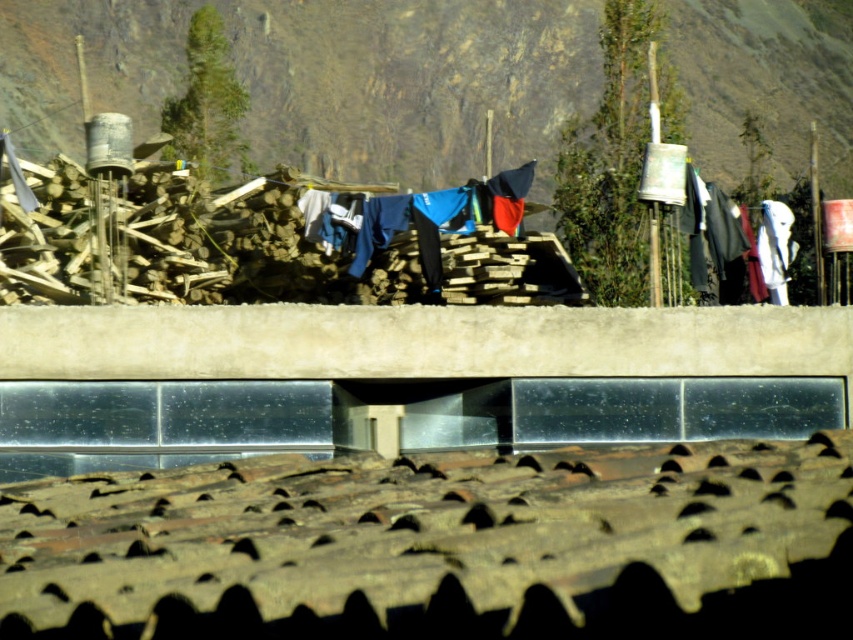
How much distance is there between rusty metal tile roof at lower center and blue fabric clothes at center?

rusty metal tile roof at lower center and blue fabric clothes at center are 16.85 meters apart from each other.

Is point (155, 557) farther from camera compared to point (471, 205)?

No, (155, 557) is closer to viewer.

This screenshot has width=853, height=640. In order to click on rusty metal tile roof at lower center in this screenshot , I will do `click(442, 545)`.

Between point (397, 10) and point (489, 209), which one is positioned in front?

Positioned in front is point (489, 209).

Does rugged rock mountain at upper center have a greater height compared to blue fabric clothes at center?

Indeed, rugged rock mountain at upper center has a greater height compared to blue fabric clothes at center.

Does point (158, 44) come behind point (419, 216)?

Yes, it is.

The height and width of the screenshot is (640, 853). Identify the location of rugged rock mountain at upper center. (321, 77).

Where is `rusty metal tile roof at lower center`? The width and height of the screenshot is (853, 640). rusty metal tile roof at lower center is located at coordinates (442, 545).

Between rusty metal tile roof at lower center and rugged rock mountain at upper center, which one appears on the right side from the viewer's perspective?

rugged rock mountain at upper center

The height and width of the screenshot is (640, 853). I want to click on rusty metal tile roof at lower center, so click(x=442, y=545).